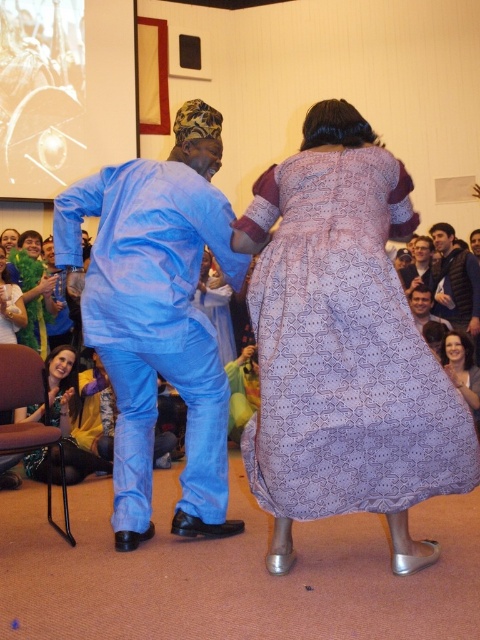
You are a photographer setting up a camera to capture the dancers. You need to decide which dancer to focus on first based on their clothing width. Which dancer should you focus on first, the one wearing the matte green dress at lower left or the matte blue suit at center?

The matte green dress at lower left might be wider than matte blue suit at center, so you should focus on the matte green dress at lower left first to ensure it fits within the frame.

You are a photographer trying to capture a closeup shot of both the dark blue vest at upper right and the matte blue suit at center. Given that your camera can only focus on one object at a time, which object should you focus on to ensure the other is still in the background but recognizable?

Since the dark blue vest at upper right is bigger than the matte blue suit at center, focusing on the dark blue vest at upper right would keep the matte blue suit at center in the background while still being recognizable.

You are a photographer trying to capture a photo of the blue cotton outfit at center and the yellow fabric at lower left. Based on their positions, which object is located to the right of the other?

The blue cotton outfit at center is positioned on the right side of yellow fabric at lower left.